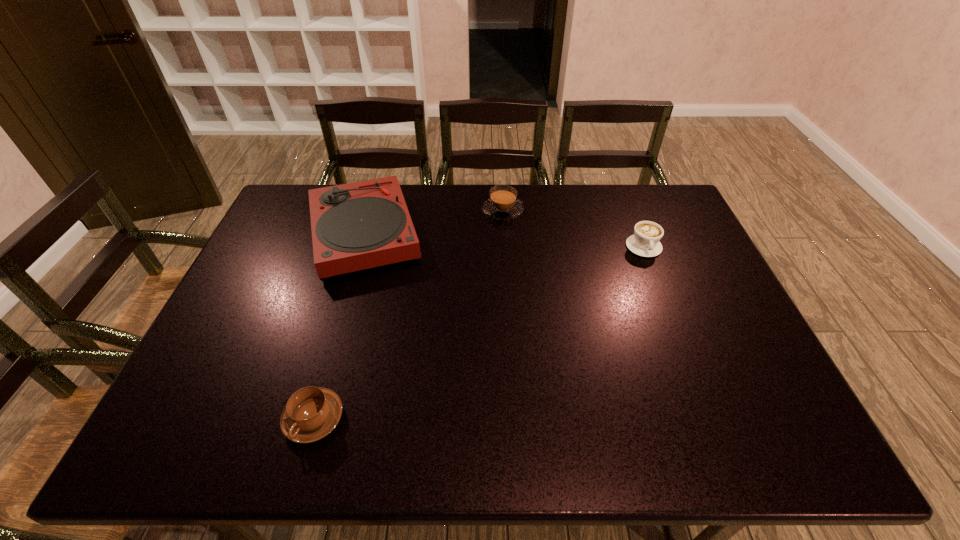
Where is `unoccupied area between the tallest object and the nearest cappuccino`? The width and height of the screenshot is (960, 540). unoccupied area between the tallest object and the nearest cappuccino is located at coordinates (339, 326).

Where is `free space between the nearest object and the rightmost object`? free space between the nearest object and the rightmost object is located at coordinates (479, 333).

Where is `blank region between the farthest cappuccino and the record player`? This screenshot has width=960, height=540. blank region between the farthest cappuccino and the record player is located at coordinates (434, 222).

I want to click on free space that is in between the farthest cappuccino and the tallest object, so click(434, 222).

Image resolution: width=960 pixels, height=540 pixels. What are the coordinates of `free spot between the rightmost object and the leftmost cappuccino` in the screenshot? It's located at (479, 333).

Locate an element on the screen. Image resolution: width=960 pixels, height=540 pixels. empty space between the rightmost cappuccino and the leftmost cappuccino is located at coordinates (479, 333).

Locate an element on the screen. Image resolution: width=960 pixels, height=540 pixels. vacant area that lies between the record player and the second farthest cappuccino is located at coordinates (504, 240).

Where is `vacant area that lies between the second cappuccino from right to left and the record player`? This screenshot has height=540, width=960. vacant area that lies between the second cappuccino from right to left and the record player is located at coordinates (434, 222).

In order to click on free space that is in between the second object from right to left and the rightmost cappuccino in this screenshot , I will do `click(573, 229)`.

This screenshot has height=540, width=960. I want to click on object that stands as the third closest to the nearest object, so click(645, 242).